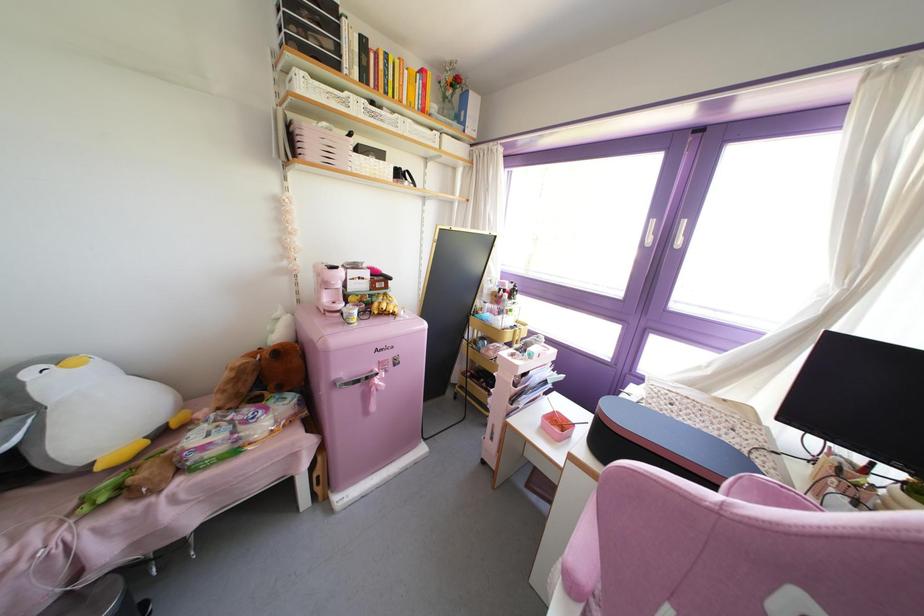
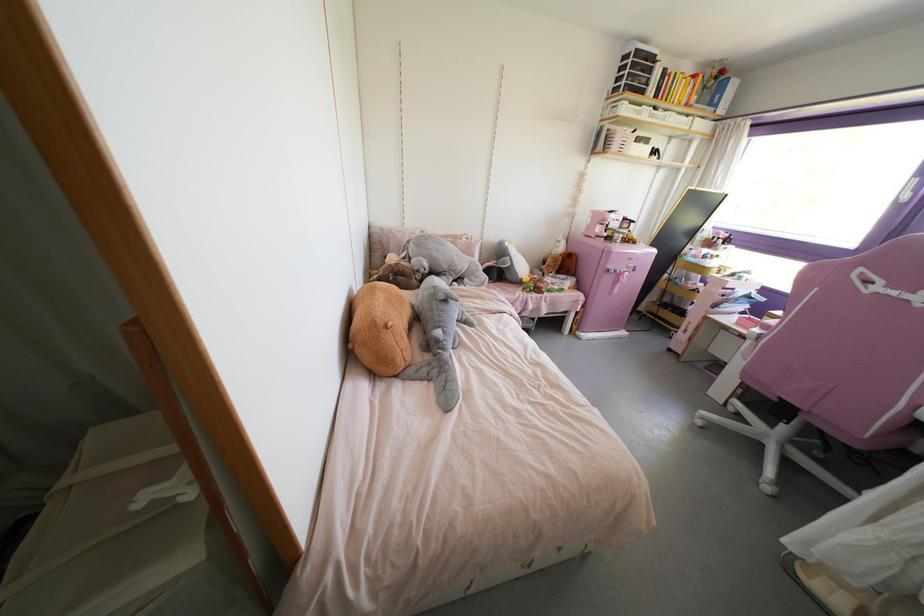
In a continuous first-person perspective shot, in which direction is the camera moving?

The cameraman moved toward left, backward.